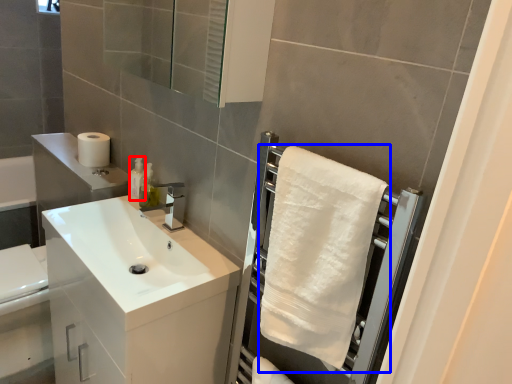
Question: Which of the following is the closest to the observer, toiletry (highlighted by a red box) or bath towel (highlighted by a blue box)?

Choices:
 (A) toiletry
 (B) bath towel

Answer: (B)